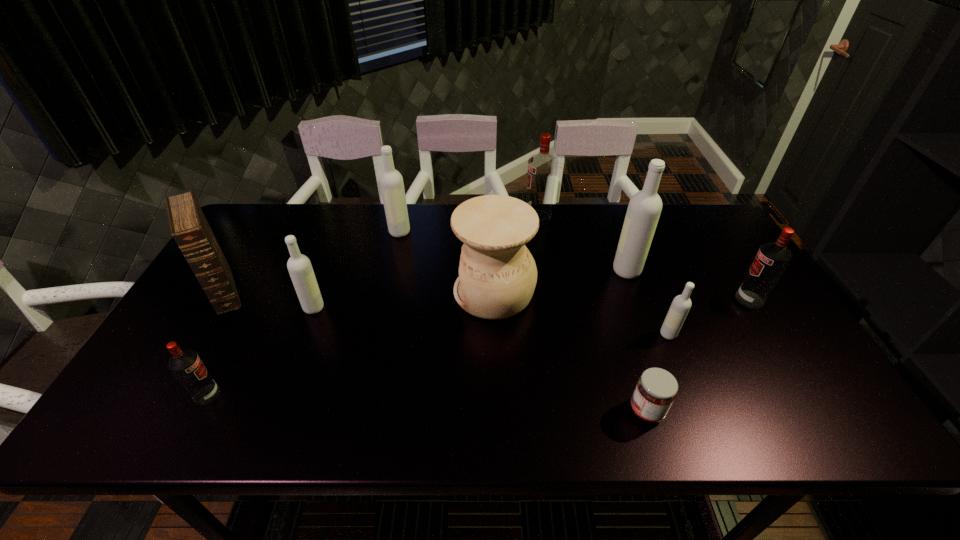
What are the coordinates of `the tallest object` in the screenshot? It's located at (644, 209).

This screenshot has width=960, height=540. In order to click on the third nearest white vodka in this screenshot , I will do `click(644, 209)`.

Identify the location of the farthest red vodka. This screenshot has width=960, height=540. (542, 168).

Where is `the second red vodka from right to left`? The height and width of the screenshot is (540, 960). the second red vodka from right to left is located at coordinates (542, 168).

Where is `the second biggest white vodka`? The image size is (960, 540). the second biggest white vodka is located at coordinates (391, 181).

In order to click on the second white vodka from left to right in this screenshot , I will do `click(391, 181)`.

Image resolution: width=960 pixels, height=540 pixels. Find the location of `Bible`. Bible is located at coordinates 188,224.

I want to click on cream pottery, so click(497, 277).

Where is `the third biggest white vodka`? The image size is (960, 540). the third biggest white vodka is located at coordinates coord(299,266).

Where is `the third object from left to right`? The image size is (960, 540). the third object from left to right is located at coordinates (299, 266).